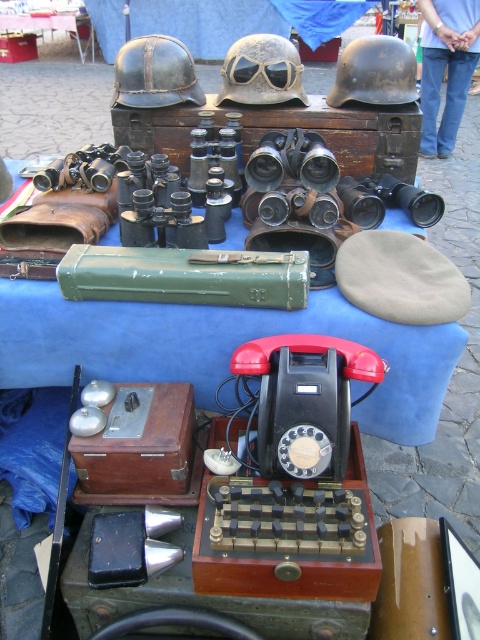
Who is more forward, (397, 58) or (259, 51)?

Positioned in front is point (397, 58).

Is matte brown helmet at center positioned behind camouflage fabric helmet at center?

No.

Which is behind, point (348, 99) or point (284, 76)?

The point (348, 99) is behind.

Locate an element on the screen. The height and width of the screenshot is (640, 480). matte brown helmet at center is located at coordinates (374, 72).

Which of these two, matte black helmet at upper left or metallic matte goggles at center, stands shorter?

metallic matte goggles at center is shorter.

Which of these two, matte black helmet at upper left or metallic matte goggles at center, stands taller?

matte black helmet at upper left

Is point (136, 45) closer to camera compared to point (236, 61)?

No, it is behind (236, 61).

Locate an element on the screen. The width and height of the screenshot is (480, 640). matte black helmet at upper left is located at coordinates (155, 74).

Which of these two, matte black helmet at upper left or matte brown helmet at center, stands shorter?

With less height is matte black helmet at upper left.

Which is below, matte black helmet at upper left or matte brown helmet at center?

matte black helmet at upper left is below.

Does point (149, 51) come behind point (399, 77)?

Yes.

You are a GUI agent. You are given a task and a screenshot of the screen. Output one action in this format:
    pyautogui.click(x=<x>, y=<y>)
    Task: Click on the matte black helmet at upper left
    The image size is (480, 640).
    Given the screenshot: What is the action you would take?
    pyautogui.click(x=155, y=74)